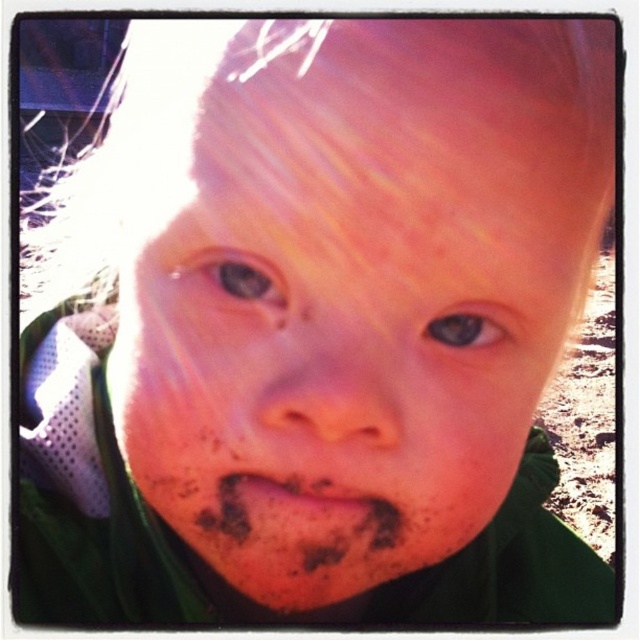
Question: Which object is closer to the camera taking this photo?

Choices:
 (A) brown matte eye at upper left
 (B) brown matte eye at center

Answer: (A)

Question: Does brown matte eye at upper left have a larger size compared to dusty brown lips at center?

Choices:
 (A) no
 (B) yes

Answer: (A)

Question: Does brown matte eye at upper left lie behind brown matte eye at center?

Choices:
 (A) no
 (B) yes

Answer: (A)

Question: Which point appears farthest from the camera in this image?

Choices:
 (A) (212, 272)
 (B) (442, 342)

Answer: (B)

Question: Does dusty brown lips at center have a smaller size compared to brown matte eye at center?

Choices:
 (A) yes
 (B) no

Answer: (B)

Question: Which point is closer to the camera?

Choices:
 (A) (250, 298)
 (B) (464, 330)
 (C) (330, 480)

Answer: (A)